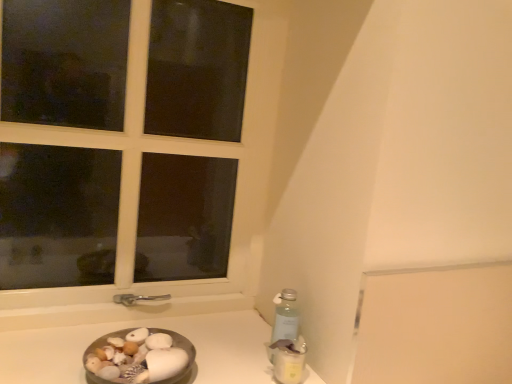
The image size is (512, 384). I want to click on vacant space behind translucent plastic bottle at lower right, so click(x=248, y=348).